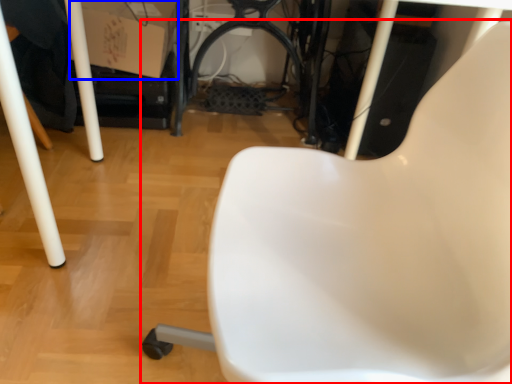
Question: Which object is further to the camera taking this photo, chair (highlighted by a red box) or cardboard box (highlighted by a blue box)?

Choices:
 (A) chair
 (B) cardboard box

Answer: (B)